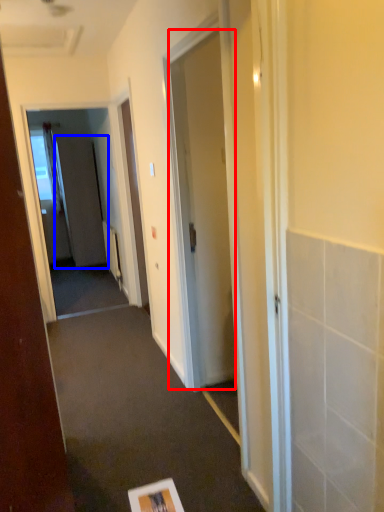
Question: Which point is closer to the camera, door (highlighted by a red box) or screen door (highlighted by a blue box)?

Choices:
 (A) door
 (B) screen door

Answer: (A)